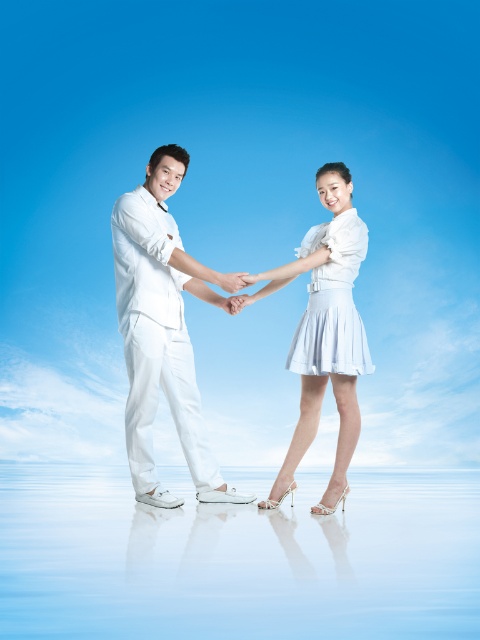
Consider the image. You are a photographer standing in front of the scene. You want to capture a photo where the white glossy water at center is in focus while keeping the white satin skirt at center slightly blurred. Is this possible with a standard camera lens?

Yes, since the white glossy water at center is closer to the viewer than the white satin skirt at center, using a standard camera lens with a wide aperture can create a shallow depth of field, allowing the closer object to be in focus and the farther one to be blurred.